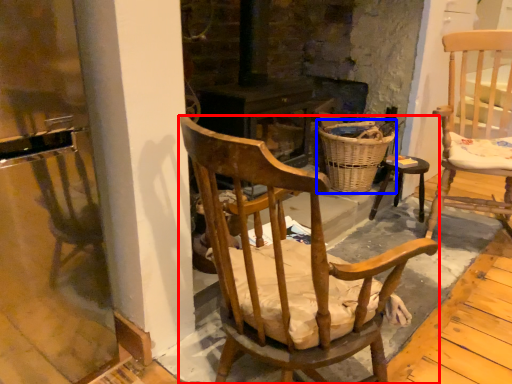
Question: Which object appears closest to the camera in this image, chair (highlighted by a red box) or basket (highlighted by a blue box)?

Choices:
 (A) chair
 (B) basket

Answer: (A)